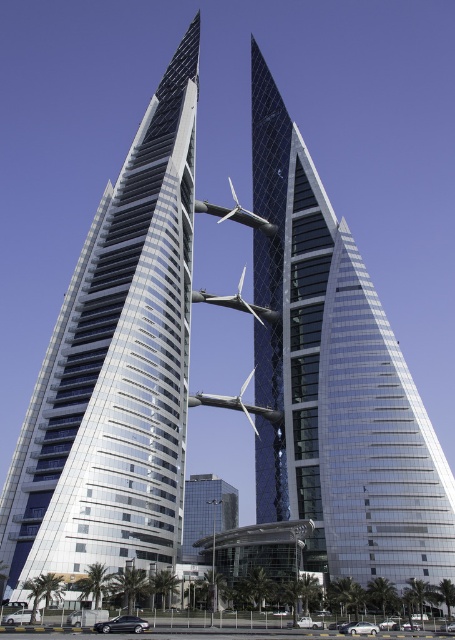
You are an architect evaluating the two skyscrapers in the image. Which of the two skyscrapers, the shiny glass skyscraper at center or the glassy silver skyscraper at center, has a greater height?

The glassy silver skyscraper at center is taller than the shiny glass skyscraper at center, so the glassy silver skyscraper at center has a greater height.

You are an architect reviewing a design for two skyscrapers. The shiny glass skyscraper at center and the glassy silver skyscraper at center are part of the design. From the perspective of someone standing in front of the buildings, which skyscraper is located to the left?

The shiny glass skyscraper at center is positioned on the left side of the glassy silver skyscraper at center, so it is the one on the left.

You are a drone operator tasked with flying a drone between the two skyscrapers in the image. The drone has a maximum flight height of 100 meters. Given that the shiny glass skyscraper at center is smaller than the glassy silver skyscraper at center, will the drone be able to pass under the connecting bridge between them?

The shiny glass skyscraper at center is smaller than the glassy silver skyscraper at center, so the connecting bridge between them is likely positioned higher than the top of the smaller skyscraper. Since the drone can fly up to 100 meters, it depends on the actual height of the bridge. However, without specific measurements, we cannot confirm if the drone can pass under the bridge.